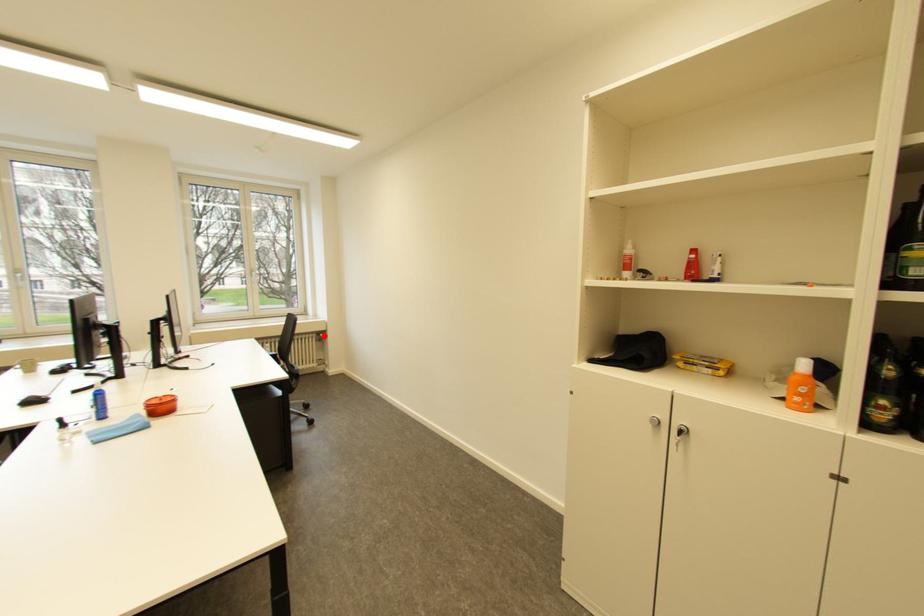
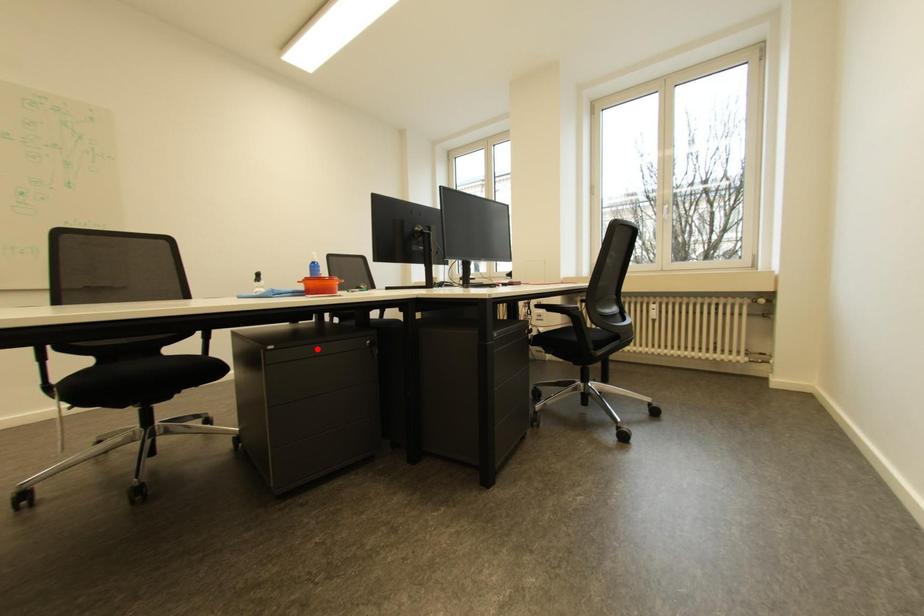
I am providing you with two images of the same scene from different viewpoints. A red point is marked on the first image and another point is marked on the second image. Is the red point in image1 aligned with the point shown in image2?

No